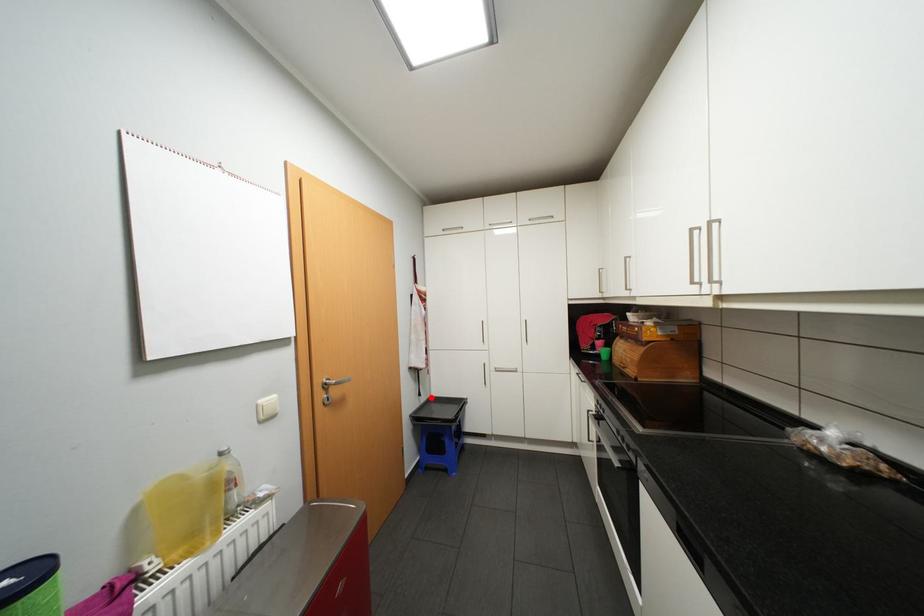
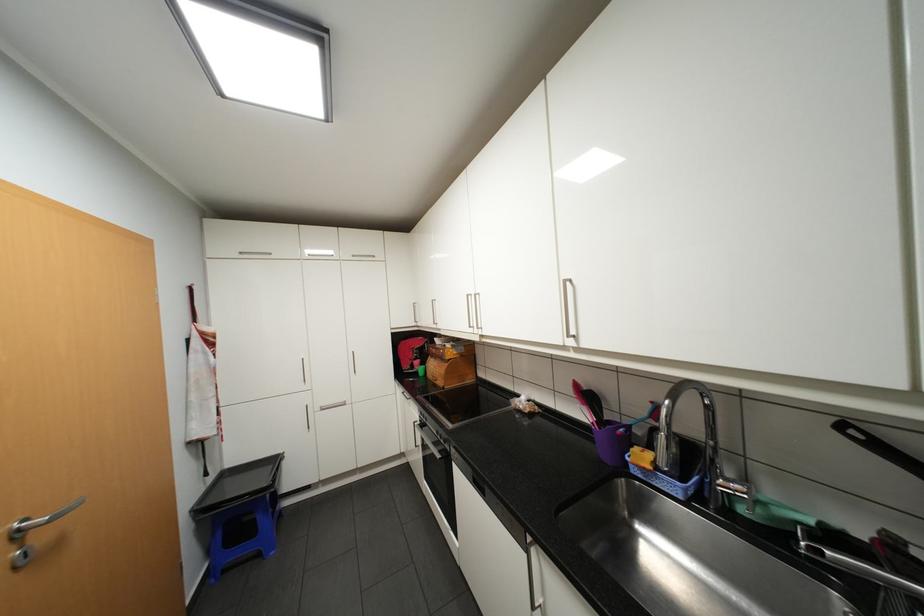
In the second image, find the point that corresponds to the highlighted location in the first image.

(220, 476)